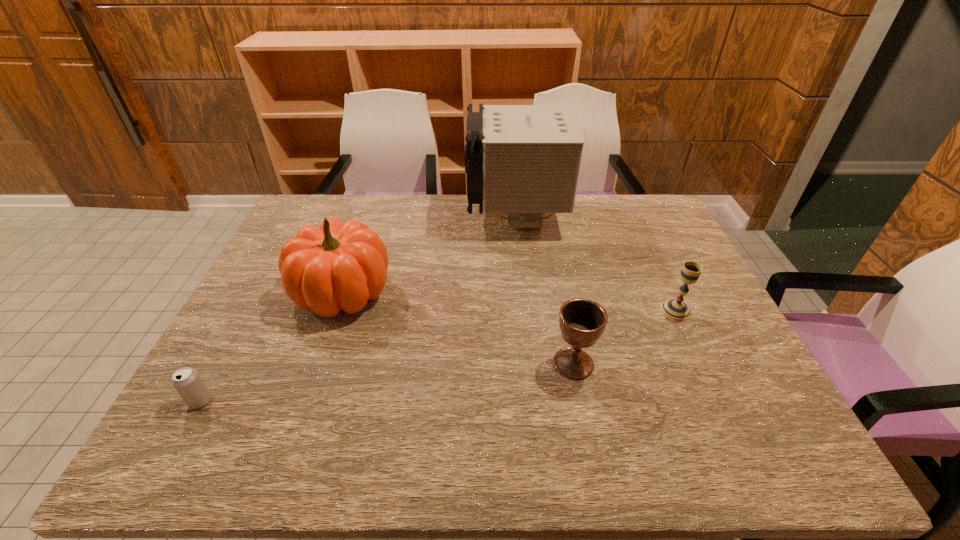
The width and height of the screenshot is (960, 540). Find the location of `vacant point located between the fourth object from right to left and the left chalice`. vacant point located between the fourth object from right to left and the left chalice is located at coordinates (458, 328).

Image resolution: width=960 pixels, height=540 pixels. Find the location of `blank region between the farthest object and the left chalice`. blank region between the farthest object and the left chalice is located at coordinates (544, 291).

Identify which object is the fourth closest to the right chalice. Please provide its 2D coordinates. Your answer should be formatted as a tuple, i.e. [(x, y)], where the tuple contains the x and y coordinates of a point satisfying the conditions above.

[(187, 381)]

Select which object appears as the second closest to the nearer chalice. Please provide its 2D coordinates. Your answer should be formatted as a tuple, i.e. [(x, y)], where the tuple contains the x and y coordinates of a point satisfying the conditions above.

[(338, 266)]

The image size is (960, 540). What are the coordinates of `free space that satisfies the following two spatial constraints: 1. on the back side of the leftmost object; 2. on the left side of the fan` in the screenshot? It's located at (301, 217).

Where is `vacant position in the image that satisfies the following two spatial constraints: 1. on the front side of the pumpkin; 2. on the right side of the second nearest object`? The width and height of the screenshot is (960, 540). vacant position in the image that satisfies the following two spatial constraints: 1. on the front side of the pumpkin; 2. on the right side of the second nearest object is located at coordinates (317, 363).

This screenshot has width=960, height=540. I want to click on free space in the image that satisfies the following two spatial constraints: 1. on the back side of the nearer chalice; 2. on the left side of the farther chalice, so click(x=563, y=310).